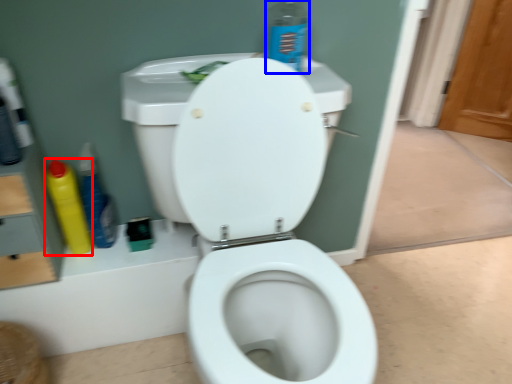
Question: Which object is closer to the camera taking this photo, cleaning product (highlighted by a red box) or cleaning product (highlighted by a blue box)?

Choices:
 (A) cleaning product
 (B) cleaning product

Answer: (B)